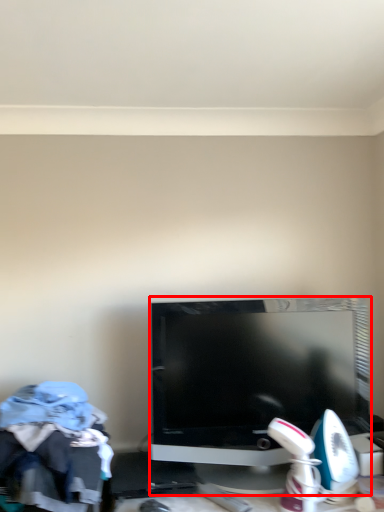
Question: From the image's perspective, where is television (annotated by the red box) located relative to clothing?

Choices:
 (A) above
 (B) below

Answer: (A)